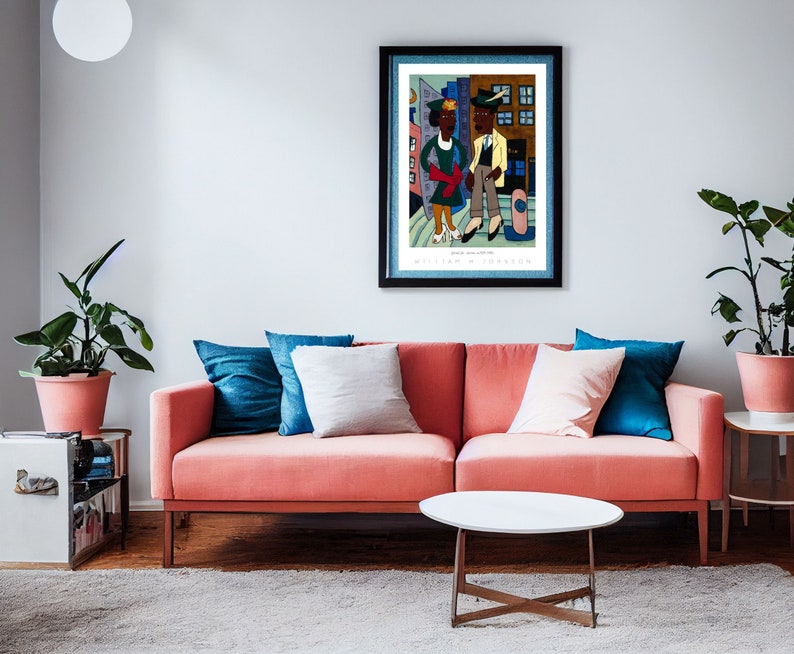
Where is `house plants`? This screenshot has height=654, width=794. house plants is located at coordinates (722, 203), (761, 228), (781, 224), (49, 331), (135, 354).